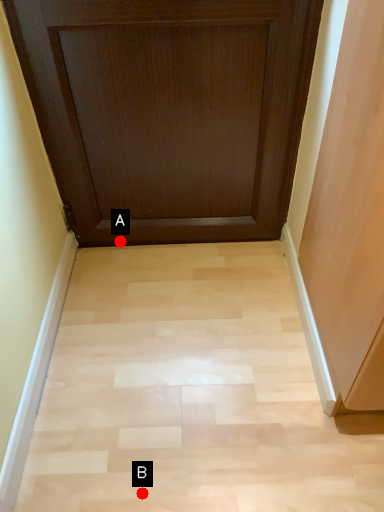
Question: Two points are circled on the image, labeled by A and B beside each circle. Which of the following is the farthest from the observer?

Choices:
 (A) A is further
 (B) B is further

Answer: (A)